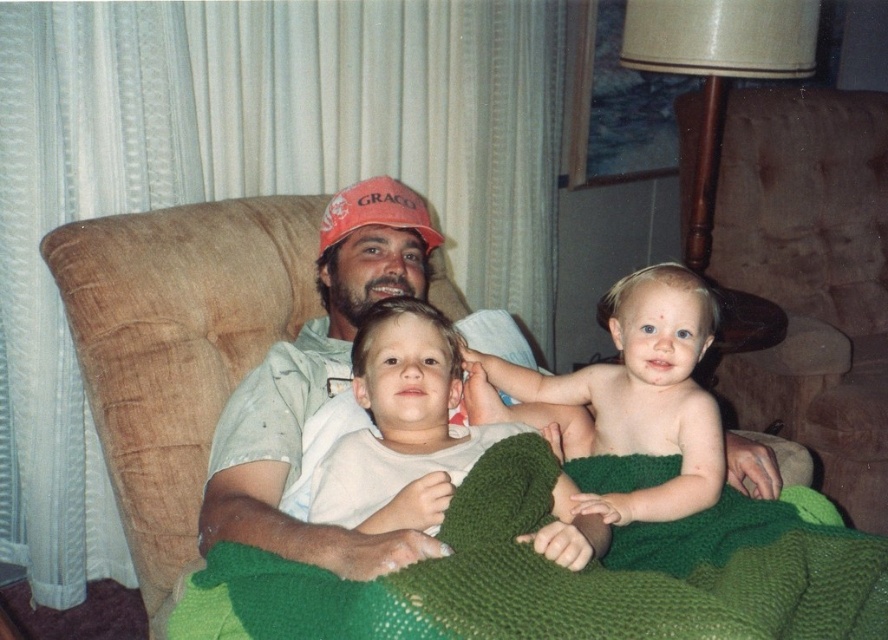
Question: Based on their relative distances, which object is farther from the orange fabric baseball cap at center?

Choices:
 (A) matte orange cap at center
 (B) smooth skin baby at center
 (C) brown fabric couch at center

Answer: (B)

Question: From the image, what is the correct spatial relationship of matte orange cap at center in relation to smooth skin baby at center?

Choices:
 (A) below
 (B) above

Answer: (B)

Question: Which point is closer to the camera taking this photo?

Choices:
 (A) click(x=361, y=193)
 (B) click(x=692, y=420)
 (C) click(x=74, y=259)

Answer: (B)

Question: Which point is farther to the camera?

Choices:
 (A) green knitted blanket at center
 (B) brown fabric couch at center

Answer: (B)

Question: Is smooth skin baby at center above smooth white shirt at center?

Choices:
 (A) no
 (B) yes

Answer: (B)

Question: Is brown fabric couch at center above smooth white shirt at center?

Choices:
 (A) no
 (B) yes

Answer: (B)